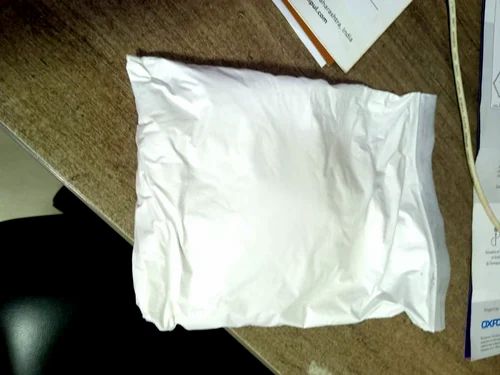
This screenshot has height=375, width=500. I want to click on beige floor, so click(x=23, y=174).